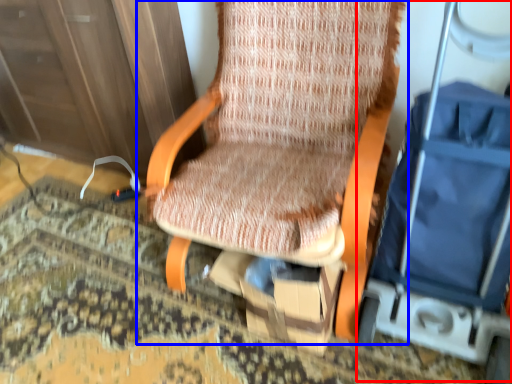
Question: Which of the following is the farthest to the observer, baby carriage (highlighted by a red box) or chair (highlighted by a blue box)?

Choices:
 (A) baby carriage
 (B) chair

Answer: (B)